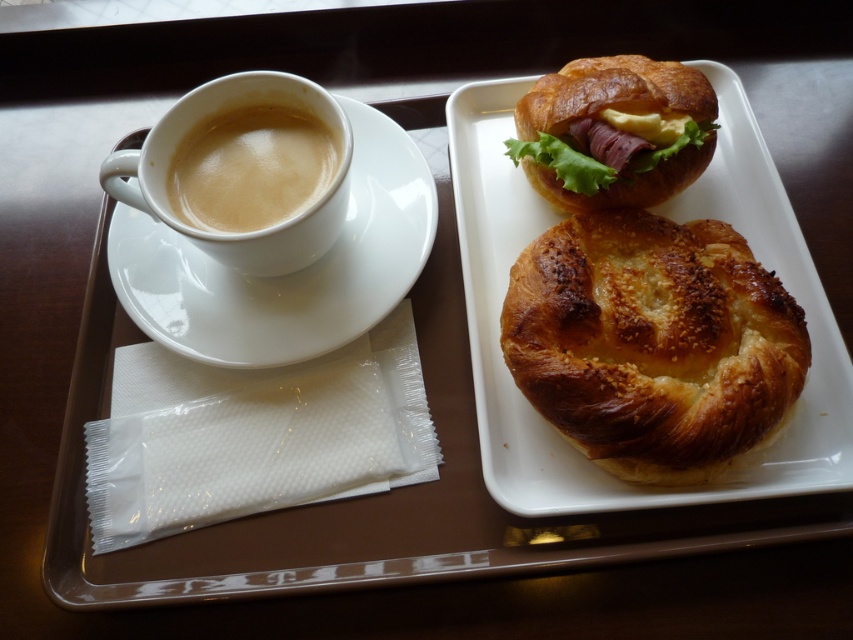
You are a chef preparing to place a new pastry on the breakfast tray. The new pastry is 10 cm wide. Which object on the tray should you move to make space, the golden brown bread at upper center or the white glossy saucer at upper left?

The golden brown bread at upper center might be wider than the white glossy saucer at upper left, so moving the white glossy saucer at upper left would not provide enough space. Therefore, you should move the golden brown bread at upper center to make room for the new pastry.

You are a waiter carrying a tray and need to place a new item between the golden brown bread at upper center and the white glossy saucer at upper left. Based on their sizes, which object should you move to make space?

Since the golden brown bread at upper center is larger than the white glossy saucer at upper left, you should move the smaller white glossy saucer at upper left to create more space for the new item.